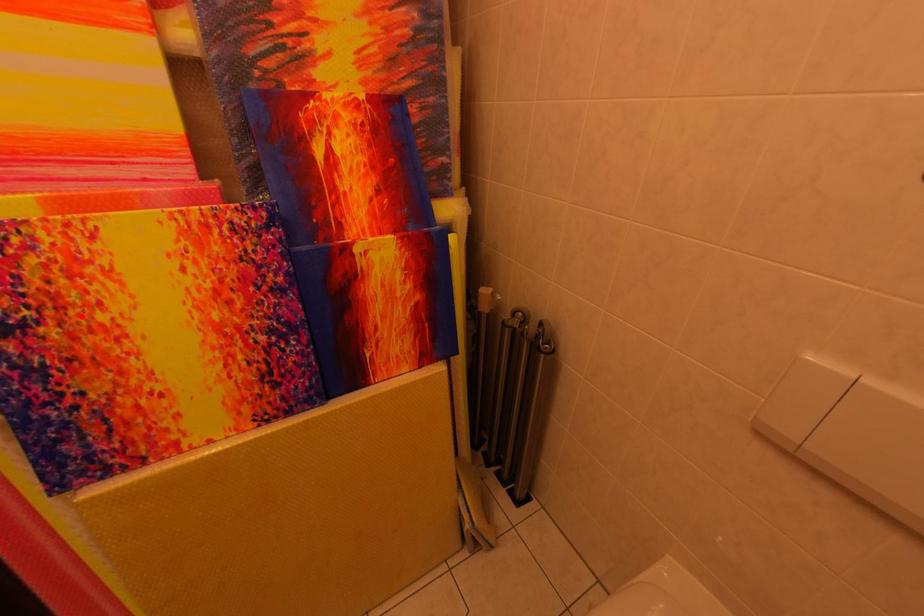
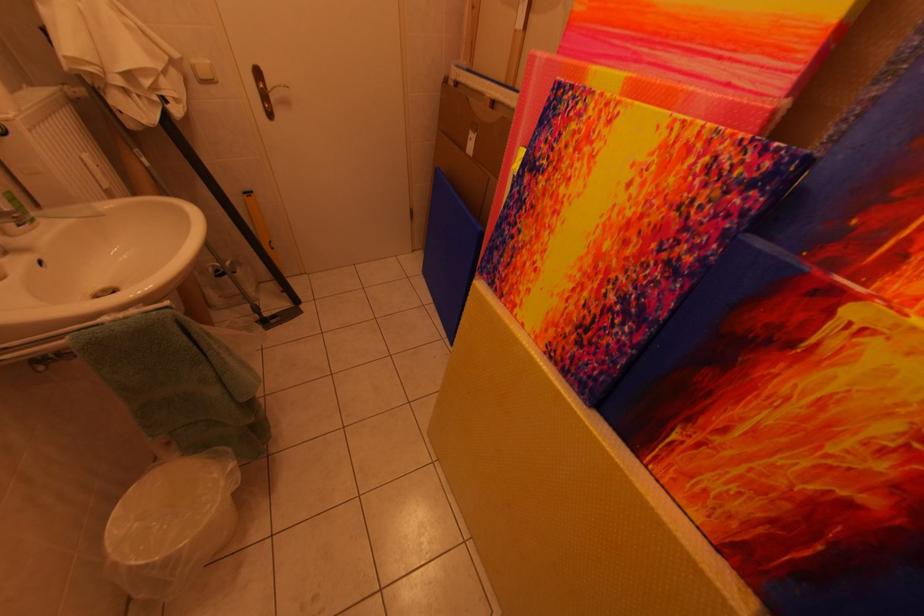
Question: I am providing you with two images of the same scene from different viewpoints. A red point is marked on the first image. At the location where the point appears in image 1, is it still visible in image 2?

Choices:
 (A) Yes
 (B) No

Answer: (A)